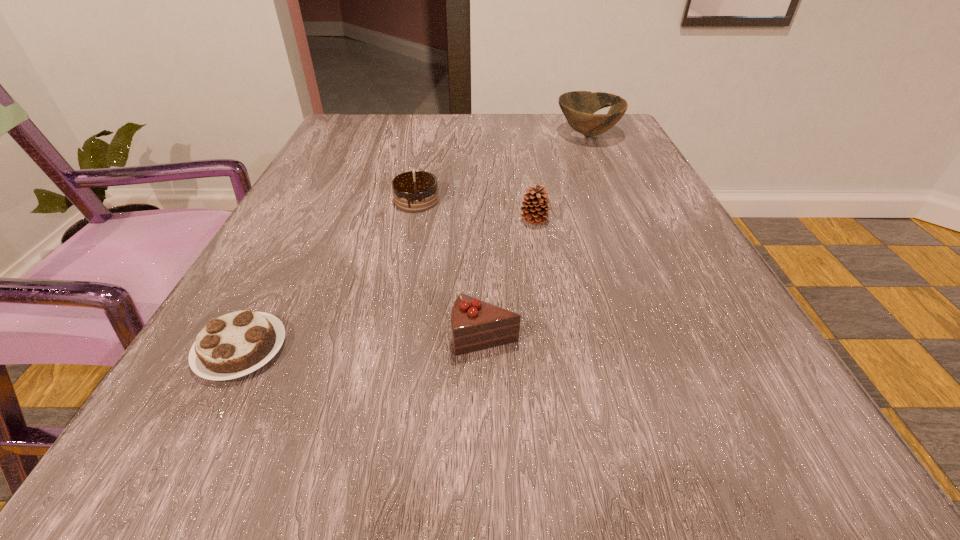
This screenshot has height=540, width=960. Find the location of `free space between the pinecone and the leftmost object`. free space between the pinecone and the leftmost object is located at coordinates (388, 285).

Find the location of a particular element. unoccupied area between the shortest object and the third object from left to right is located at coordinates (363, 343).

At what (x,y) coordinates should I click in order to perform the action: click on blank region between the pinecone and the rightmost object. Please return your answer as a coordinate pair (x, y). The height and width of the screenshot is (540, 960). Looking at the image, I should click on (561, 178).

Identify the location of empty space that is in between the third object from left to right and the rightmost object. (537, 235).

Where is `object that stands as the second closest to the rightmost object`? Image resolution: width=960 pixels, height=540 pixels. object that stands as the second closest to the rightmost object is located at coordinates (415, 191).

Identify which object is the nearest to the shortest chocolate cake. Please provide its 2D coordinates. Your answer should be formatted as a tuple, i.e. [(x, y)], where the tuple contains the x and y coordinates of a point satisfying the conditions above.

[(475, 325)]

Identify which chocolate cake is located as the third nearest to the pinecone. Please provide its 2D coordinates. Your answer should be formatted as a tuple, i.e. [(x, y)], where the tuple contains the x and y coordinates of a point satisfying the conditions above.

[(235, 344)]

This screenshot has height=540, width=960. Identify the location of chocolate cake object that ranks as the third closest to the farthest object. (235, 344).

What are the coordinates of `vacant region that satisfies the following two spatial constraints: 1. on the back side of the farthest object; 2. on the left side of the farthest chocolate cake` in the screenshot? It's located at (430, 134).